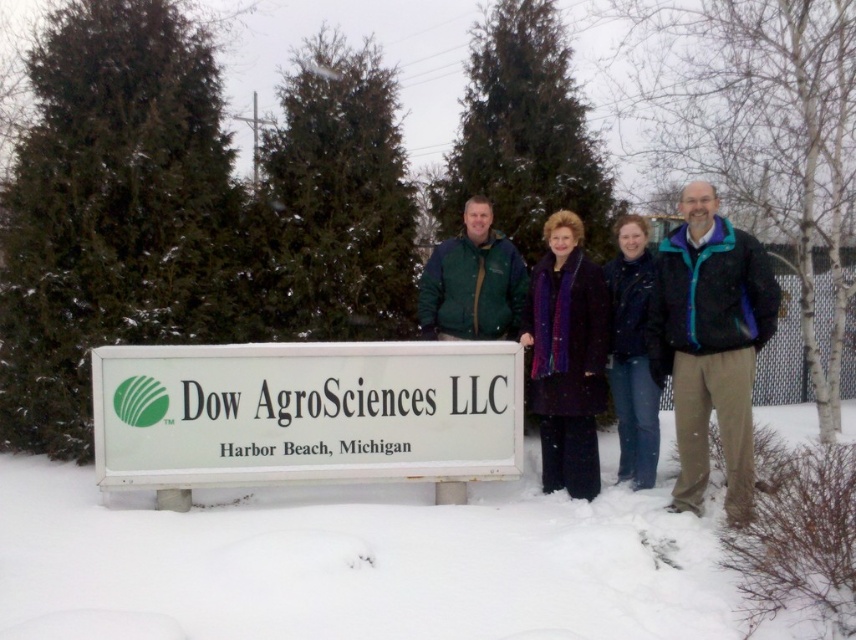
Question: Considering the real-world distances, which object is farthest from the matte green jacket at center?

Choices:
 (A) purple wool coat at center
 (B) white powdery snow at lower center

Answer: (B)

Question: Is white plastic sign at center closer to the viewer compared to blue denim jeans at lower right?

Choices:
 (A) yes
 (B) no

Answer: (A)

Question: Can you confirm if purple wool coat at center is positioned below blue denim jeans at lower right?

Choices:
 (A) no
 (B) yes

Answer: (B)

Question: Which of the following is the closest to the observer?

Choices:
 (A) (682, 250)
 (B) (108, 412)
 (C) (640, 465)
 (D) (461, 516)

Answer: (B)

Question: Does white plastic sign at center appear on the left side of purple wool coat at center?

Choices:
 (A) no
 (B) yes

Answer: (B)

Question: Which object is positioned closest to the purple wool coat at center?

Choices:
 (A) white plastic sign at center
 (B) blue denim jeans at lower right
 (C) white powdery snow at lower center

Answer: (B)